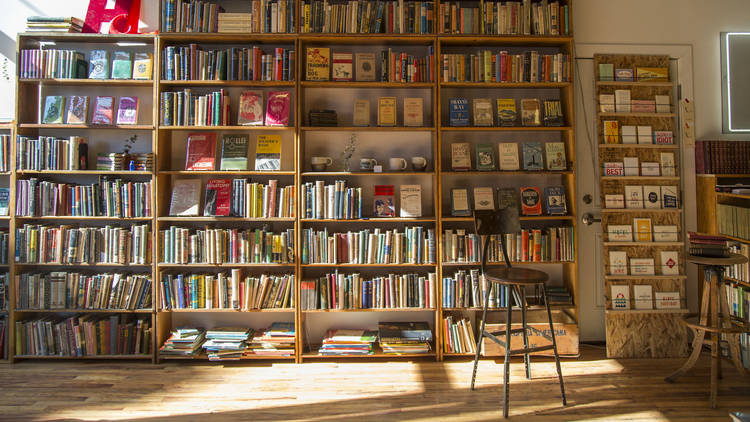
Where is `smaller shelf with post cards`? The width and height of the screenshot is (750, 422). smaller shelf with post cards is located at coordinates (651, 152).